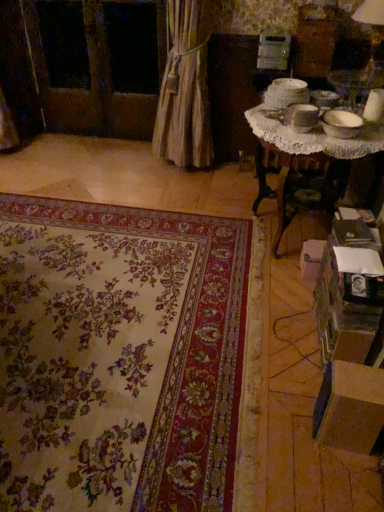
The height and width of the screenshot is (512, 384). I want to click on unoccupied area in front of white lace table at upper right, so click(264, 312).